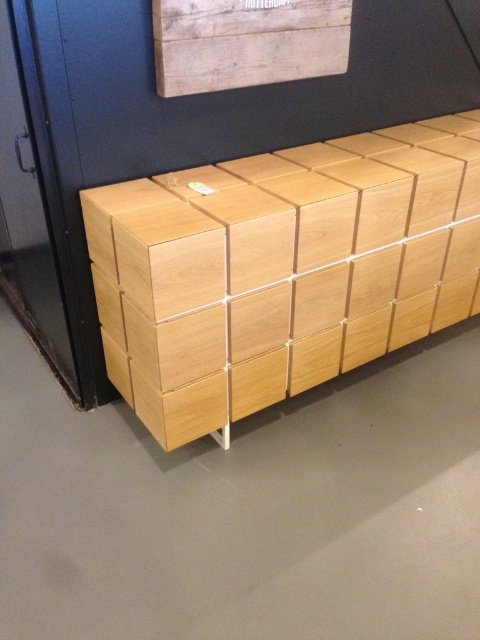
You are arranging items on the storage unit and need to place a decorative vase between the natural wood crate at center and the wooden crate at upper center. Based on their positions, where should you place the vase?

The natural wood crate at center is to the right of the wooden crate at upper center, so you should place the vase between them to the left of the natural wood crate at center and to the right of the wooden crate at upper center.

You are standing in the room and want to reach the natural wood crate at center to place a book on it. Considering your arm length is 0.7 meters, can you reach it without moving closer?

The natural wood crate at center is 1.44 meters away from you. Since your arm length is 0.7 meters, you cannot reach it without moving closer because the distance is greater than your arm length.